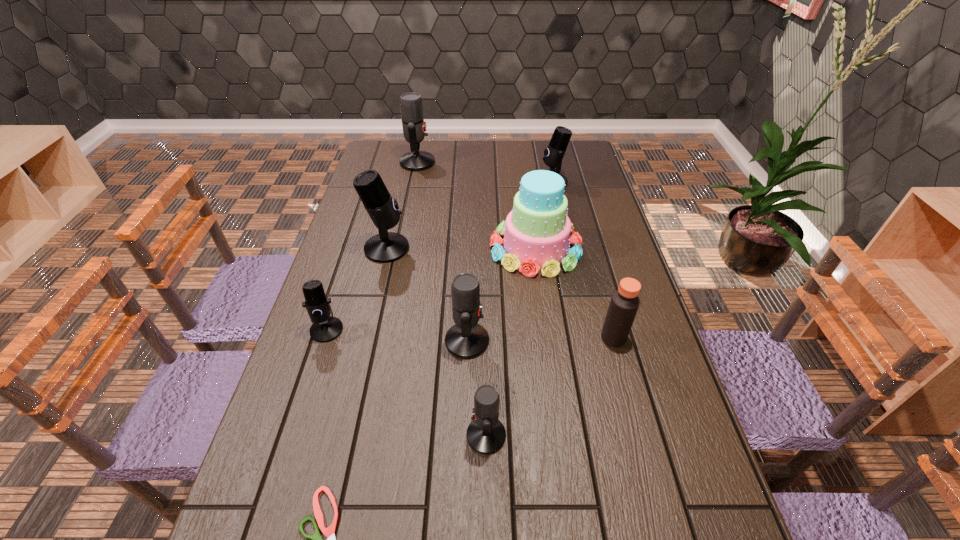
Locate which red microphone is the third closest to the green scissors. Please provide its 2D coordinates. Your answer should be formatted as a tuple, i.e. [(x, y)], where the tuple contains the x and y coordinates of a point satisfying the conditions above.

[(414, 128)]

Locate which red microphone ranks second in proximity to the blue cake. Please provide its 2D coordinates. Your answer should be formatted as a tuple, i.e. [(x, y)], where the tuple contains the x and y coordinates of a point satisfying the conditions above.

[(414, 128)]

At what (x,y) coordinates should I click in order to perform the action: click on black microphone object that ranks as the third closest to the second nearest red microphone. Please return your answer as a coordinate pair (x, y). The image size is (960, 540). Looking at the image, I should click on (553, 155).

Where is `the second closest black microphone to the farthest black microphone`? the second closest black microphone to the farthest black microphone is located at coordinates (325, 328).

I want to click on vacant region that satisfies the following two spatial constraints: 1. on the side of the farthest microphone with the red ring; 2. on the right side of the blue cake, so click(400, 248).

Where is `free space that satisfies the following two spatial constraints: 1. on the front side of the cake; 2. on the left side of the vinegar`? free space that satisfies the following two spatial constraints: 1. on the front side of the cake; 2. on the left side of the vinegar is located at coordinates [x=548, y=338].

Locate an element on the screen. free point that satisfies the following two spatial constraints: 1. on the front side of the vinegar; 2. on the side of the nearest red microphone with the red ring is located at coordinates (640, 435).

The height and width of the screenshot is (540, 960). Identify the location of free space that satisfies the following two spatial constraints: 1. on the stand of the brown vinegar; 2. on the left side of the second smallest black microphone. (587, 338).